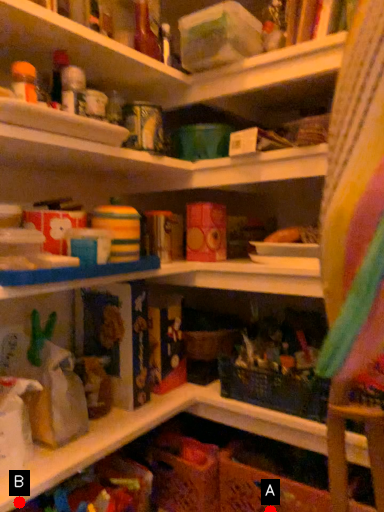
Question: Two points are circled on the image, labeled by A and B beside each circle. Which point is farther from the camera taking this photo?

Choices:
 (A) A is further
 (B) B is further

Answer: (A)